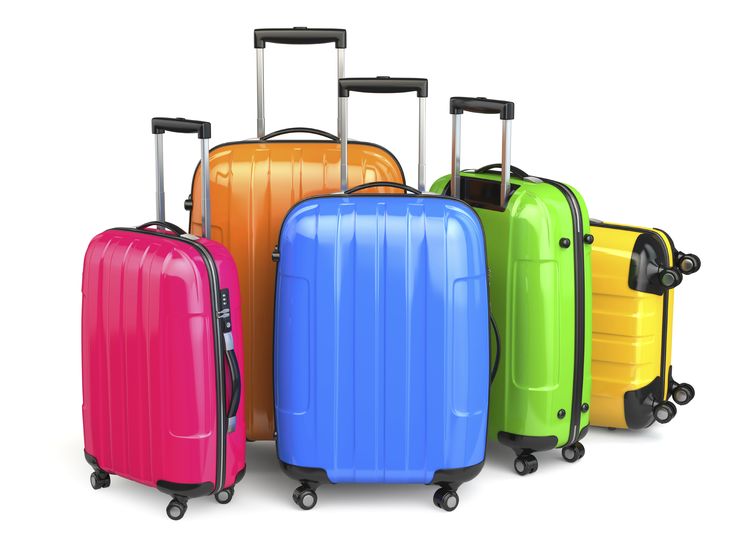
Locate an element on the screen. This screenshot has height=552, width=736. handle is located at coordinates (182, 134), (391, 90), (308, 40), (494, 110).